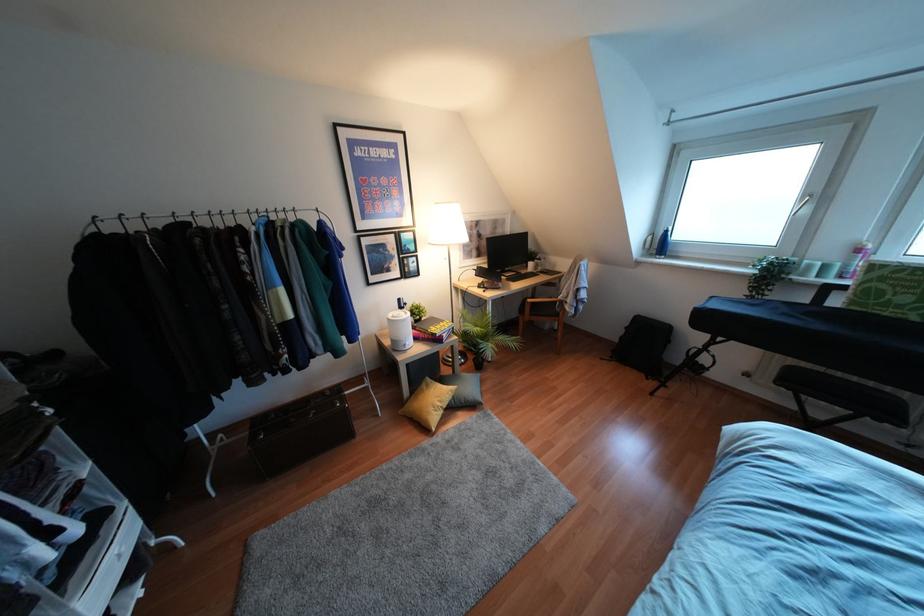
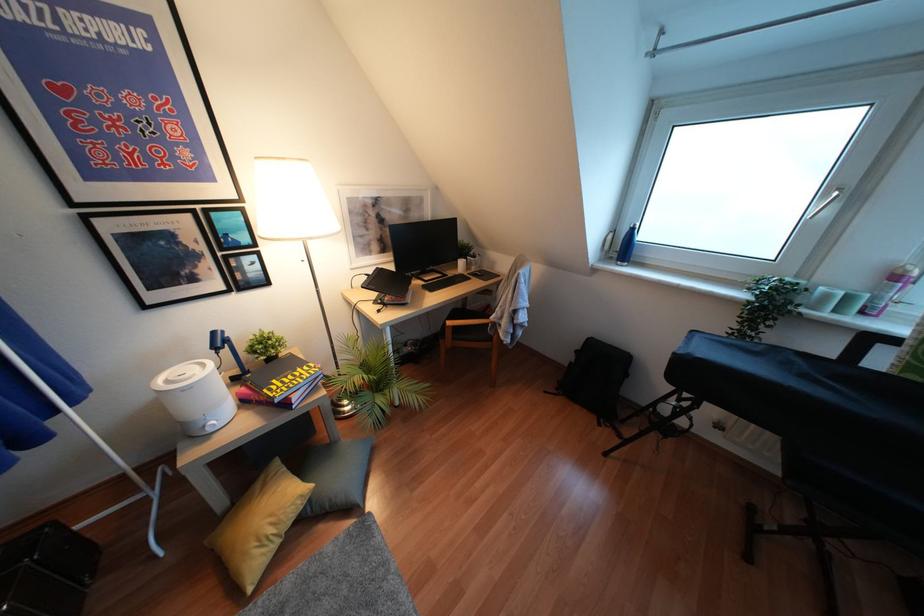
Which direction would the cameraman need to move to produce the second image?

The cameraman moved toward right, forward.